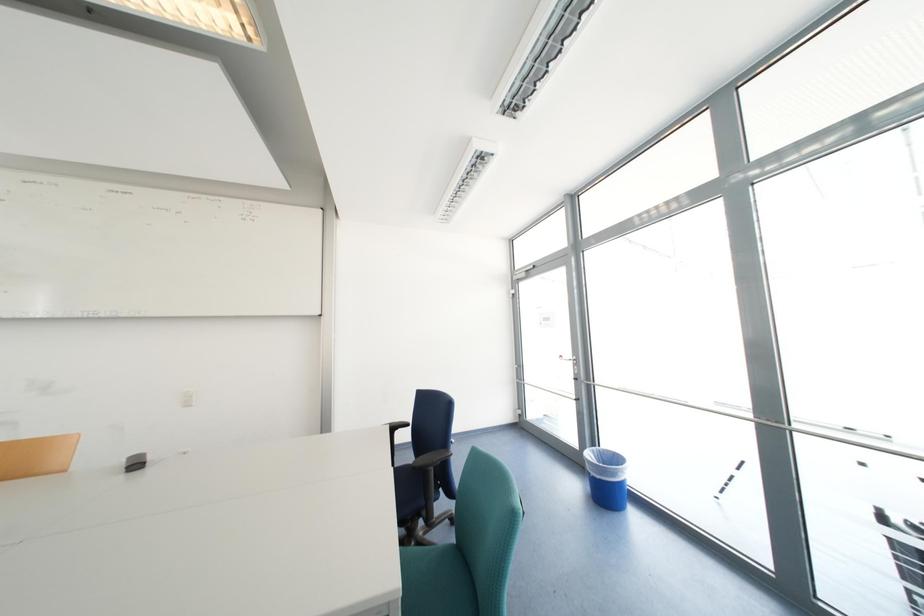
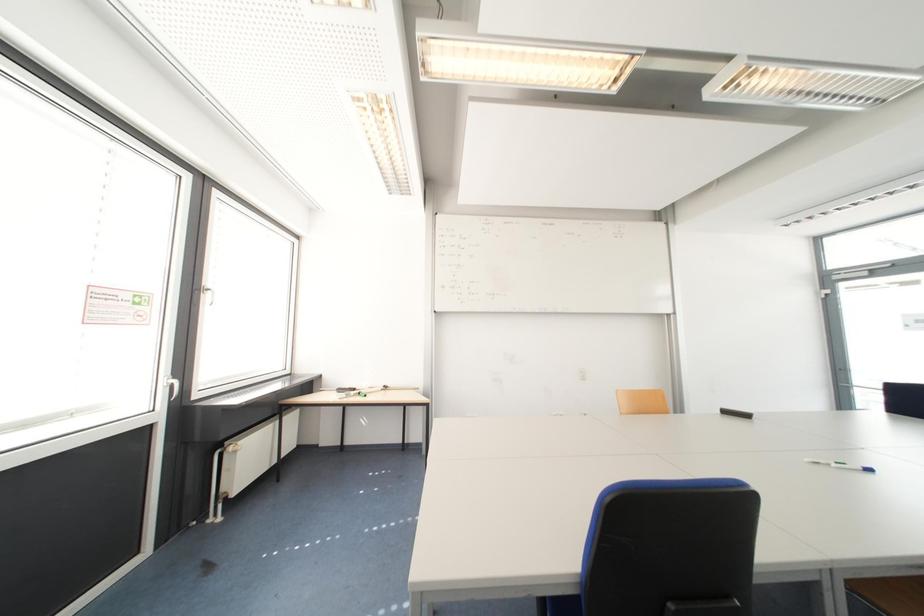
Question: Which direction would the cameraman need to move to produce the second image? Reply with the corresponding letter.

Choices:
 (A) Left
 (B) Right
 (C) Forward
 (D) Backward

Answer: (A)